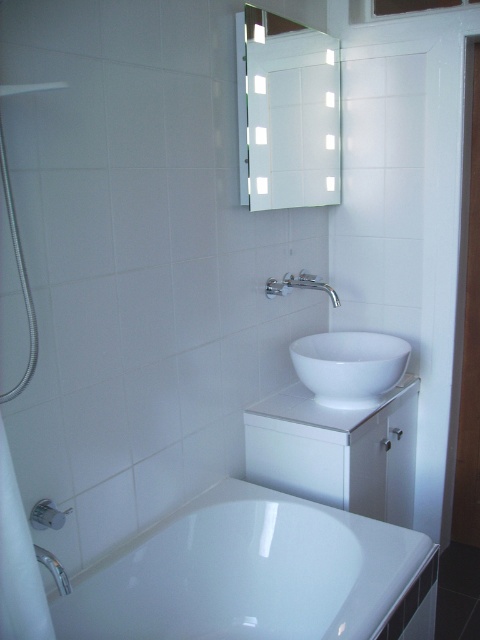
Is point (202, 512) farther from viewer compared to point (315, 349)?

No, it is not.

Does white glossy bathtub at lower left appear over white glossy bowl at center?

No.

Is point (231, 481) positioned before point (356, 340)?

Yes, point (231, 481) is in front of point (356, 340).

Image resolution: width=480 pixels, height=640 pixels. What are the coordinates of `white glossy bathtub at lower left` in the screenshot? It's located at coord(256,576).

This screenshot has width=480, height=640. Identify the location of white glossy bathtub at lower left. (256, 576).

Is white glossy bathtub at lower left taller than white glossy mirror at upper center?

In fact, white glossy bathtub at lower left may be shorter than white glossy mirror at upper center.

Between white glossy bathtub at lower left and white glossy mirror at upper center, which one has more height?

Standing taller between the two is white glossy mirror at upper center.

The height and width of the screenshot is (640, 480). I want to click on white glossy bathtub at lower left, so click(x=256, y=576).